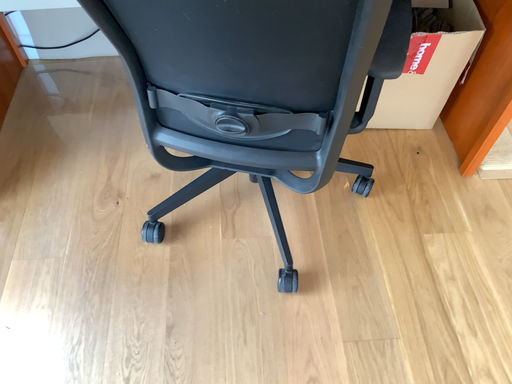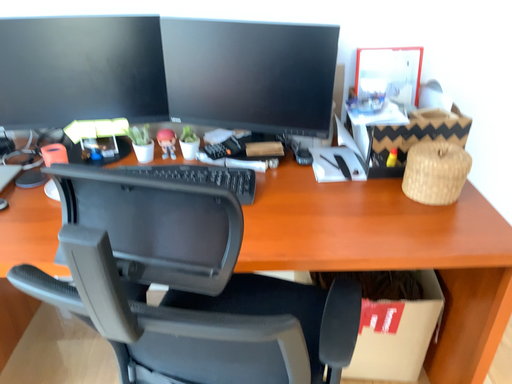
Question: How did the camera likely rotate when shooting the video?

Choices:
 (A) rotated downward
 (B) rotated upward

Answer: (B)